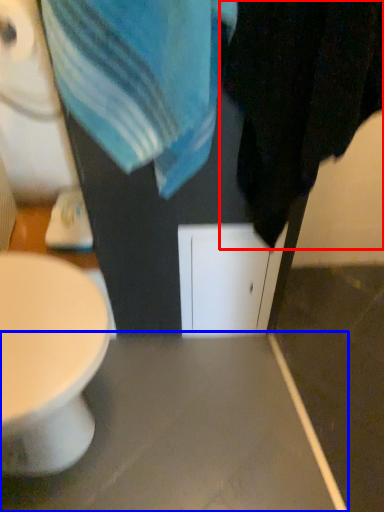
Question: Which of the following is the closest to the observer, bath towel (highlighted by a red box) or table (highlighted by a blue box)?

Choices:
 (A) bath towel
 (B) table

Answer: (A)